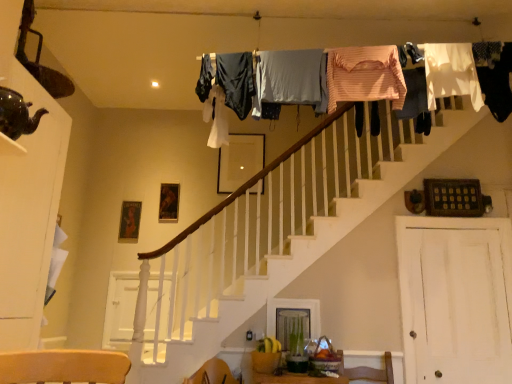
Question: Looking at their shapes, would you say white fabric at upper right, the sixth clothing in the left-to-right sequence, is wider or thinner than pink fabric at upper right, placed as the 3th clothing when sorted from right to left?

Choices:
 (A) thin
 (B) wide

Answer: (B)

Question: From a real-world perspective, is white fabric at upper right, the 2th clothing positioned from the right, positioned above or below pink fabric at upper right, placed as the 3th clothing when sorted from right to left?

Choices:
 (A) above
 (B) below

Answer: (B)

Question: Estimate the real-world distances between objects in this image. Which object is farther from the pink striped fabric at upper center, which ranks as the fourth clothing in right-to-left order?

Choices:
 (A) shiny dark green teapot at upper left
 (B) light gray fabric at upper center, which ranks as the fifth clothing in right-to-left order
 (C) black fabric at upper right, the first clothing positioned from the right
 (D) white fabric at upper right, the 2th clothing positioned from the right
 (E) white painted wood at lower left, the 1th barn door viewed from the back

Answer: (E)

Question: Which object is positioned closest to the light gray fabric at upper center, acting as the 3th clothing starting from the left?

Choices:
 (A) pink striped fabric at upper center, which ranks as the fourth clothing in right-to-left order
 (B) white fabric at upper right, the 2th clothing positioned from the right
 (C) white wood door at right, which ranks as the second barn door in left-to-right order
 (D) dark blue fabric at upper center, marked as the second clothing in a left-to-right arrangement
 (E) white painted wood at lower left, the 1th barn door viewed from the back

Answer: (D)